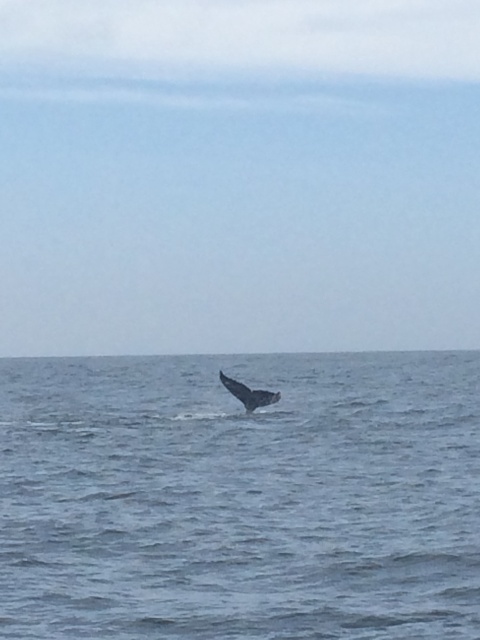
Looking at this image, you are standing on a boat looking at the ocean. You see a point at coordinates point (240, 497). What is located at that point?

The blue water at center is located at point (240, 497).

You are a sailor navigating a small boat and need to determine the position of two points on the ocean surface. The first point is at coordinates point (456, 380), and the second is at point (277, 392). According to the scene, which point is closer to the horizon?

Point (277, 392) is closer to the horizon because it is in front of point (456, 380), which is behind it.